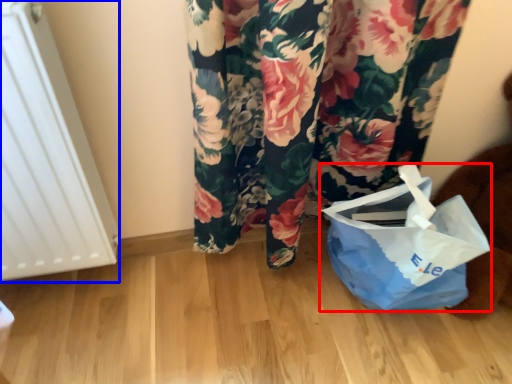
Question: Which object appears closest to the camera in this image, plastic bag (highlighted by a red box) or radiator (highlighted by a blue box)?

Choices:
 (A) plastic bag
 (B) radiator

Answer: (B)